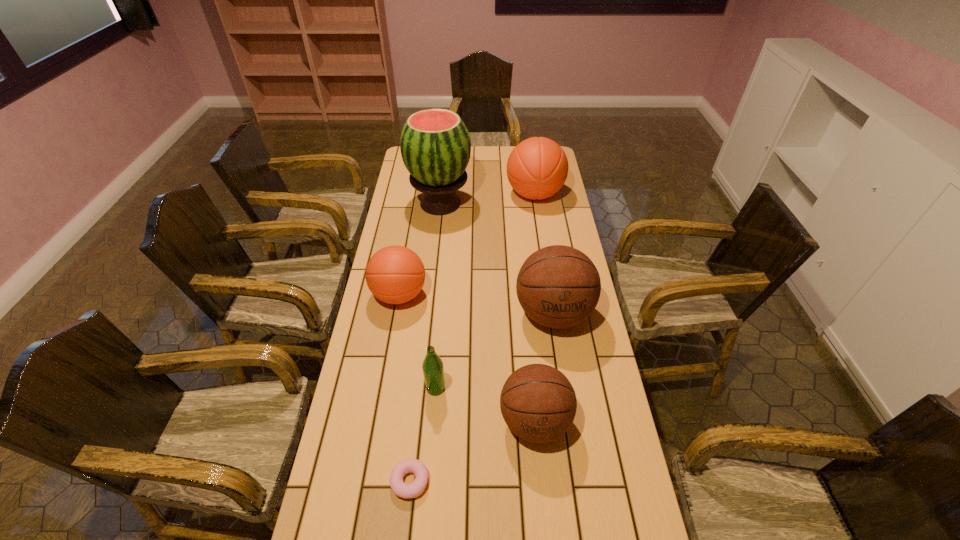
You are a GUI agent. You are given a task and a screenshot of the screen. Output one action in this format:
    pyautogui.click(x=<x>, y=<y>)
    Task: Click on the doughnut
    This screenshot has height=540, width=960.
    Given the screenshot: What is the action you would take?
    pyautogui.click(x=410, y=465)

The height and width of the screenshot is (540, 960). Find the location of `the nearest object`. the nearest object is located at coordinates (410, 465).

At what (x,y) coordinates should I click in order to perform the action: click on vacant point located on the right of the tallest object. Please return your answer as a coordinate pair (x, y). The width and height of the screenshot is (960, 540). Looking at the image, I should click on (540, 204).

You are a GUI agent. You are given a task and a screenshot of the screen. Output one action in this format:
    pyautogui.click(x=<x>, y=<y>)
    Task: Click on the free point located on the back of the farther orange basketball
    This screenshot has height=540, width=960.
    Given the screenshot: What is the action you would take?
    tap(531, 168)

Find the location of `free space located 0.120m on the side with brand label of the bigger brown basketball`. free space located 0.120m on the side with brand label of the bigger brown basketball is located at coordinates (564, 378).

Where is `vacant region located 0.180m on the back of the smaller orange basketball`? The width and height of the screenshot is (960, 540). vacant region located 0.180m on the back of the smaller orange basketball is located at coordinates (408, 243).

You are a GUI agent. You are given a task and a screenshot of the screen. Output one action in this format:
    pyautogui.click(x=<x>, y=<y>)
    Task: Click on the vacant space located on the side with brand label of the nearest basketball
    This screenshot has height=540, width=960.
    Given the screenshot: What is the action you would take?
    pyautogui.click(x=542, y=505)

Where is `free space located on the front of the bottle`? The image size is (960, 540). free space located on the front of the bottle is located at coordinates (424, 532).

I want to click on free spot located 0.240m on the back of the pink doughnut, so click(420, 381).

Identify the location of watermelon present at the left edge. The image size is (960, 540). (435, 145).